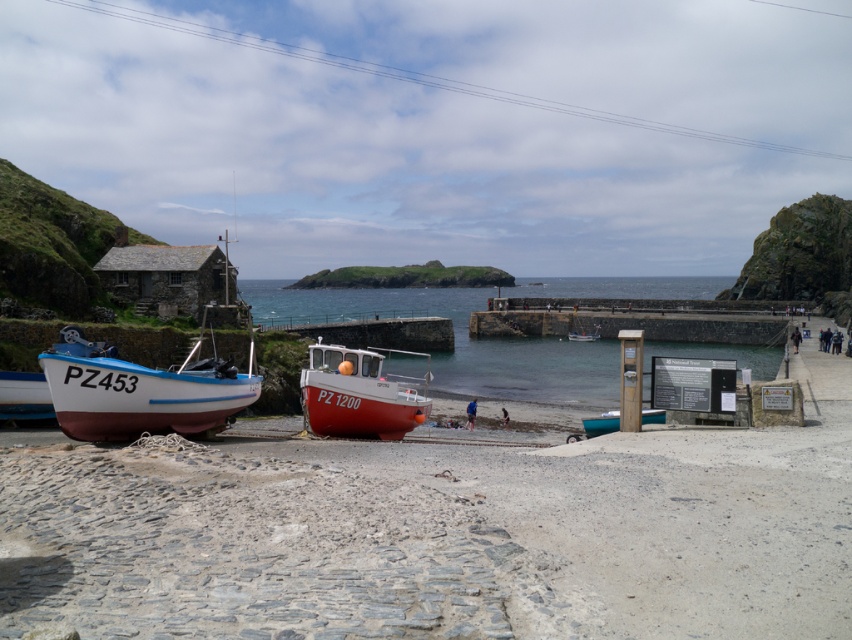
Question: Which object appears closest to the camera in this image?

Choices:
 (A) white wooden boat at left
 (B) white matte boat at lower left

Answer: (B)

Question: Considering the real-world distances, which object is closest to the white wooden boat at left?

Choices:
 (A) teal matte canoe at center
 (B) white matte boat at lower left
 (C) white matte boat at center

Answer: (B)

Question: Does clear blue water at center appear over white matte boat at lower left?

Choices:
 (A) yes
 (B) no

Answer: (A)

Question: Can you confirm if clear blue water at center is bigger than white wooden boat at left?

Choices:
 (A) no
 (B) yes

Answer: (B)

Question: Is white wooden boat at left bigger than white matte boat at center?

Choices:
 (A) no
 (B) yes

Answer: (B)

Question: Which point is farther from the camera taking this photo?

Choices:
 (A) (326, 348)
 (B) (706, 355)
 (C) (582, 339)
 (D) (616, 426)

Answer: (C)